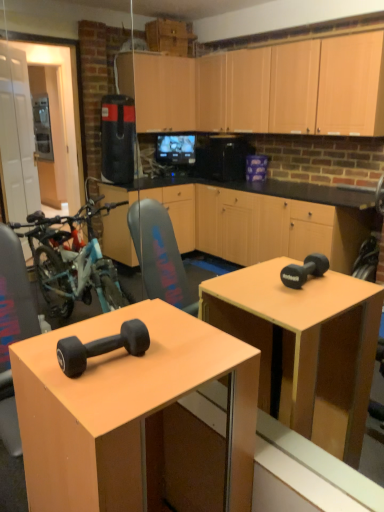
Question: Is point (137, 338) positioned closer to the camera than point (102, 486)?

Choices:
 (A) closer
 (B) farther

Answer: (B)

Question: Considering the positions of black rubber dumbbell at lower left and matte black dumbbell at center in the image, is black rubber dumbbell at lower left wider or thinner than matte black dumbbell at center?

Choices:
 (A) wide
 (B) thin

Answer: (B)

Question: Is black rubber dumbbell at lower left in front of or behind matte black dumbbell at center in the image?

Choices:
 (A) front
 (B) behind

Answer: (B)

Question: Considering the positions of matte black dumbbell at center and black rubber dumbbell at lower left in the image, is matte black dumbbell at center wider or thinner than black rubber dumbbell at lower left?

Choices:
 (A) thin
 (B) wide

Answer: (B)

Question: Considering the positions of matte black dumbbell at center and black rubber dumbbell at lower left in the image, is matte black dumbbell at center bigger or smaller than black rubber dumbbell at lower left?

Choices:
 (A) small
 (B) big

Answer: (B)

Question: From the image's perspective, is matte black dumbbell at center located above or below black rubber dumbbell at lower left?

Choices:
 (A) above
 (B) below

Answer: (B)

Question: Do you think matte black dumbbell at center is within black rubber dumbbell at lower left, or outside of it?

Choices:
 (A) outside
 (B) inside

Answer: (A)